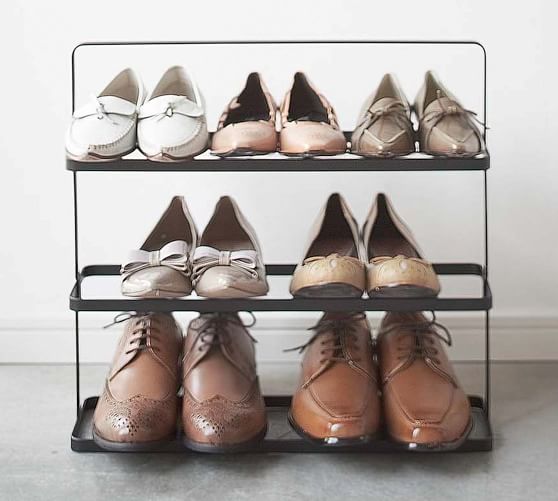
The image size is (558, 501). I want to click on middle shelf shoe, so click(x=148, y=287), click(x=235, y=284), click(x=335, y=281), click(x=424, y=281).